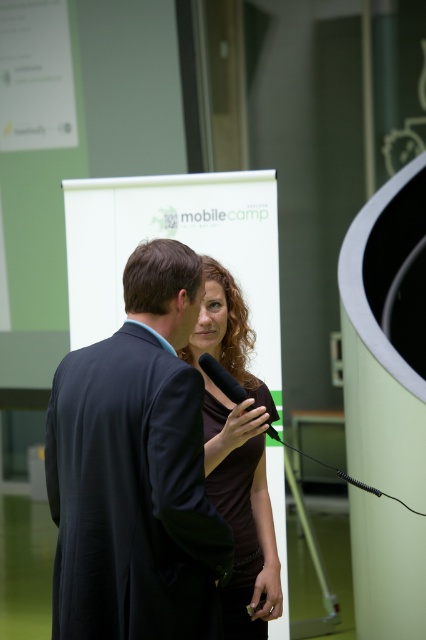
Is point (224, 355) more distant than point (198, 360)?

Yes, it is behind point (198, 360).

You are a GUI agent. You are given a task and a screenshot of the screen. Output one action in this format:
    pyautogui.click(x=<x>, y=<y>)
    Task: Click on the brown matte dress at center
    The height and width of the screenshot is (640, 426).
    Given the screenshot: What is the action you would take?
    pyautogui.click(x=238, y=458)

Which is behind, point (75, 512) or point (210, 368)?

The point (210, 368) is more distant.

Between dark blue suit at center and black matte microphone at center, which one is positioned higher?

Positioned higher is black matte microphone at center.

Between point (161, 509) and point (224, 371), which one is positioned behind?

The point (224, 371) is more distant.

Where is `dark blue suit at center`? The width and height of the screenshot is (426, 640). dark blue suit at center is located at coordinates (135, 468).

Who is higher up, dark blue suit at center or brown matte dress at center?

dark blue suit at center is higher up.

The image size is (426, 640). In order to click on dark blue suit at center in this screenshot , I will do `click(135, 468)`.